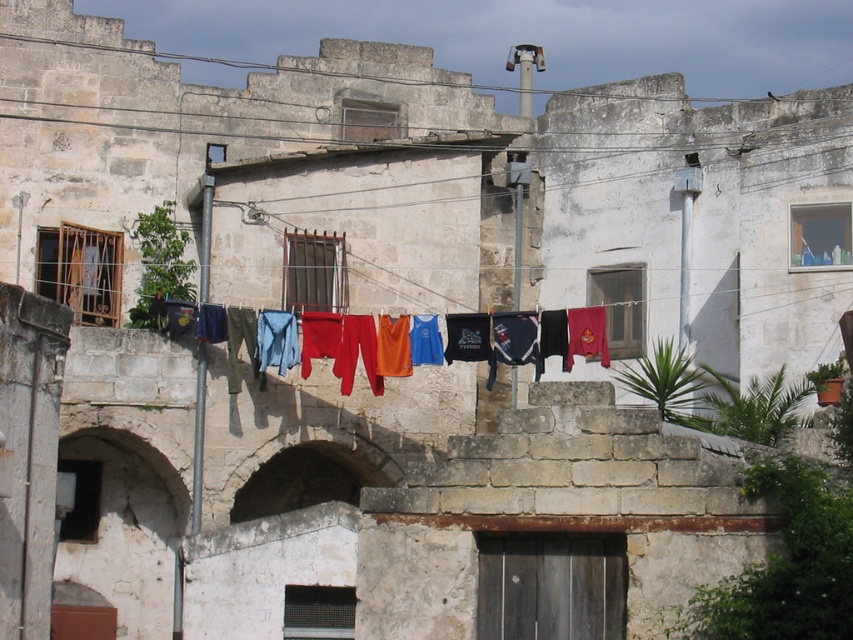
Question: Is stone archway at center bigger than multicolored fabric at center?

Choices:
 (A) yes
 (B) no

Answer: (A)

Question: Which point appears closest to the camera in this image?

Choices:
 (A) (309, 342)
 (B) (306, 433)

Answer: (A)

Question: Among these points, which one is farthest from the camera?

Choices:
 (A) (288, 492)
 (B) (467, 356)

Answer: (A)

Question: Is stone archway at center to the right of multicolored fabric at center from the viewer's perspective?

Choices:
 (A) yes
 (B) no

Answer: (B)

Question: Can you confirm if stone archway at center is smaller than multicolored fabric at center?

Choices:
 (A) yes
 (B) no

Answer: (B)